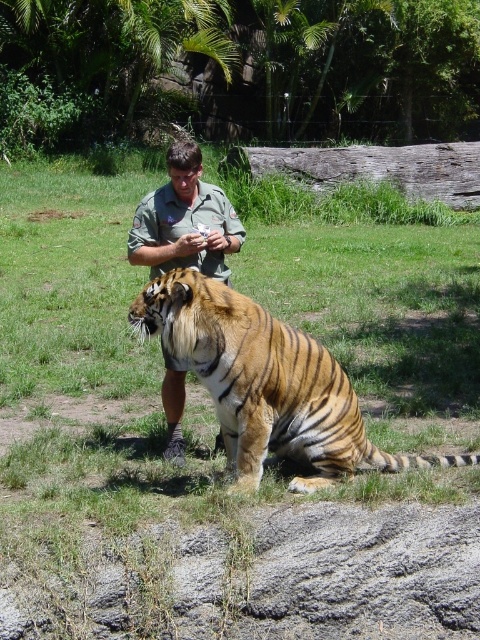
Question: Can you confirm if orange striped tiger at center is smaller than green uniform at center?

Choices:
 (A) no
 (B) yes

Answer: (A)

Question: Is the position of orange striped tiger at center more distant than that of green uniform at center?

Choices:
 (A) yes
 (B) no

Answer: (B)

Question: Which point is farther from the camera taking this photo?

Choices:
 (A) (179, 440)
 (B) (315, 448)

Answer: (A)

Question: Which object appears closest to the camera in this image?

Choices:
 (A) green uniform at center
 (B) orange striped tiger at center

Answer: (B)

Question: Considering the relative positions of orange striped tiger at center and green uniform at center in the image provided, where is orange striped tiger at center located with respect to green uniform at center?

Choices:
 (A) right
 (B) left

Answer: (A)